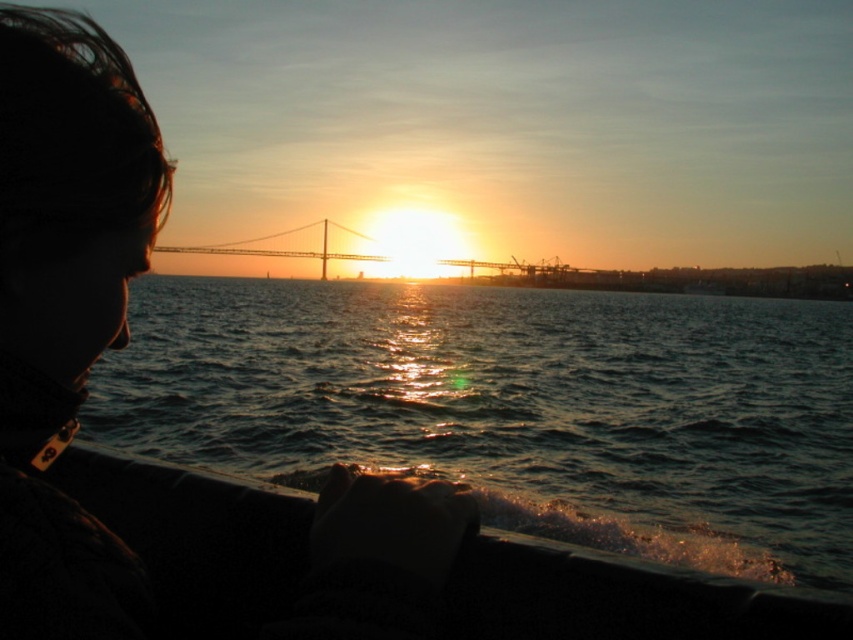
Between point (552, 310) and point (282, 230), which one is positioned in front?

Point (552, 310) is in front.

Does glistening water at lower center appear under metallic bridge at center?

Indeed, glistening water at lower center is positioned under metallic bridge at center.

This screenshot has width=853, height=640. What do you see at coordinates (515, 406) in the screenshot?
I see `glistening water at lower center` at bounding box center [515, 406].

At what (x,y) coordinates should I click in order to perform the action: click on glistening water at lower center. Please return your answer as a coordinate pair (x, y). The width and height of the screenshot is (853, 640). Looking at the image, I should click on (515, 406).